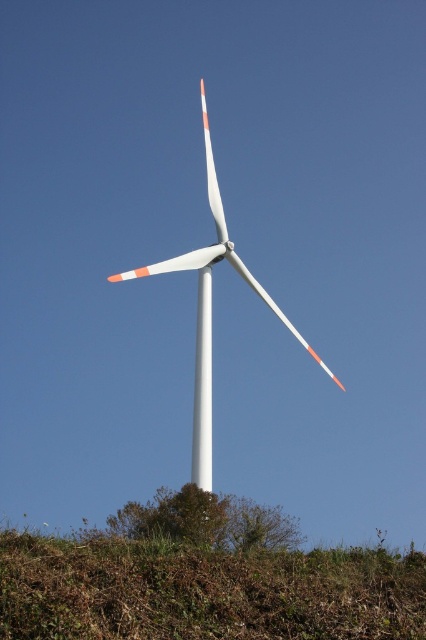
Who is more forward, (x=212, y=580) or (x=219, y=216)?

Positioned in front is point (x=212, y=580).

Between green grassy at lower center and white matte windmill at center, which one appears on the left side from the viewer's perspective?

From the viewer's perspective, green grassy at lower center appears more on the left side.

Is point (282, 627) positioned after point (210, 324)?

No, (282, 627) is in front of (210, 324).

Identify the location of green grassy at lower center. (204, 592).